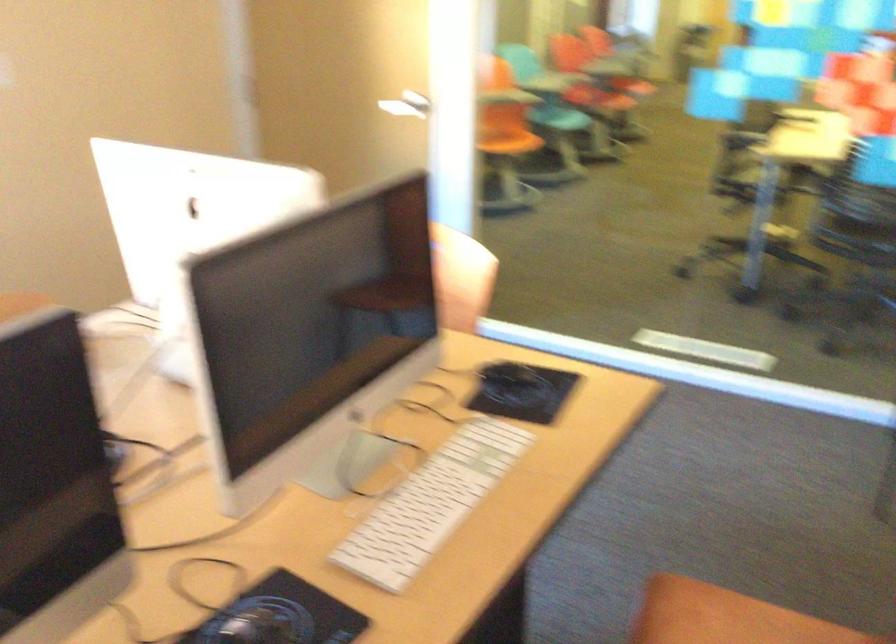
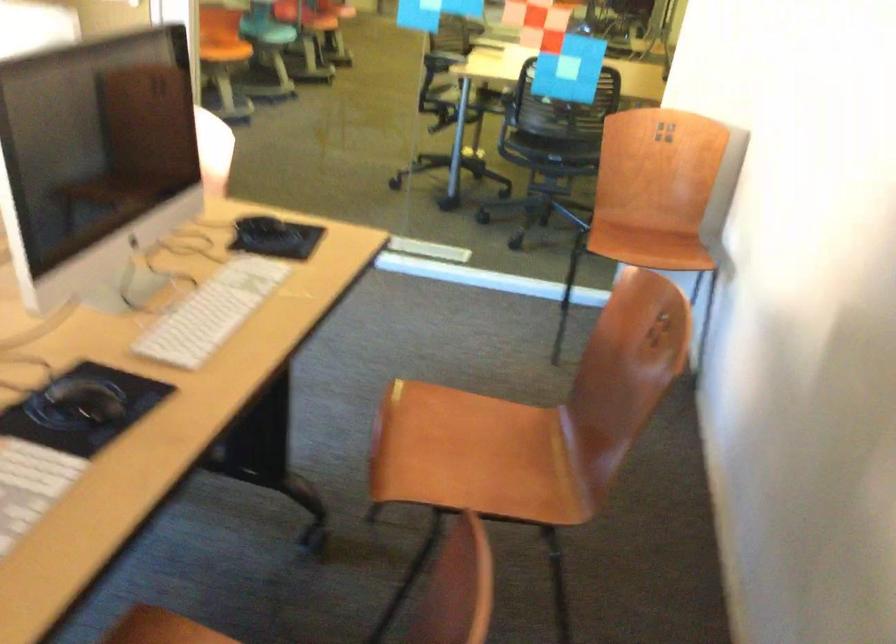
The images are taken continuously from a first-person perspective. In which direction are you moving?

The cameraman walked toward left, backward.